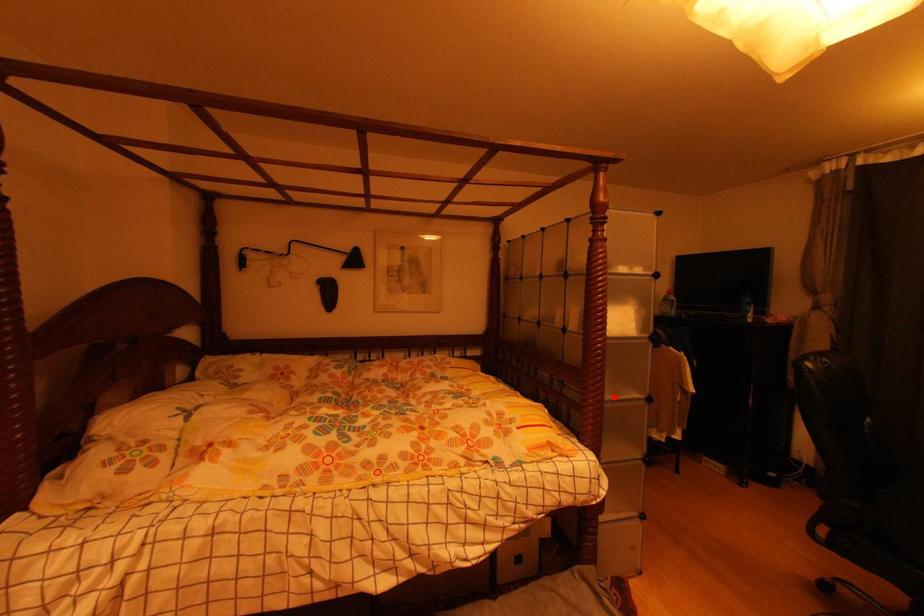
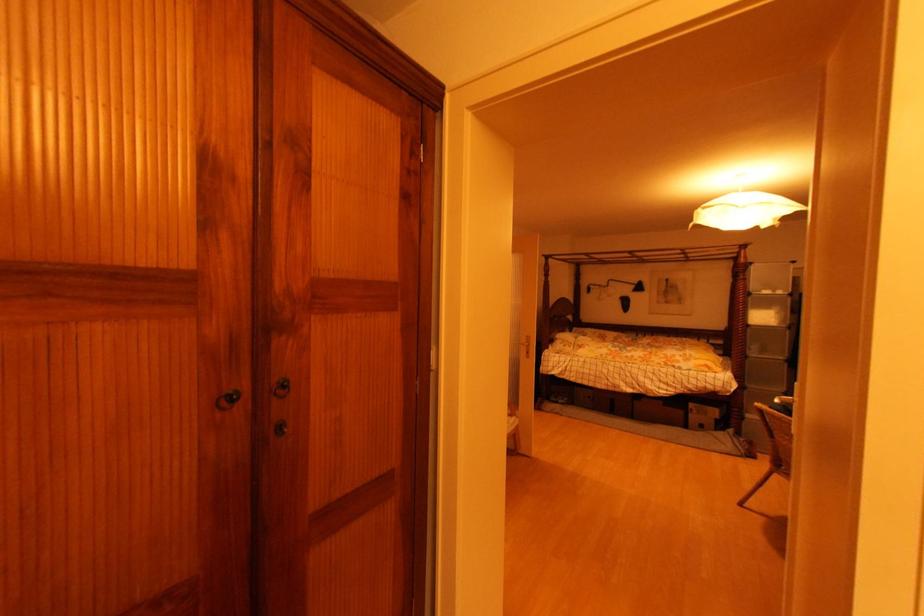
Find the pixel in the second image that matches the highlighted location in the first image.

(759, 355)